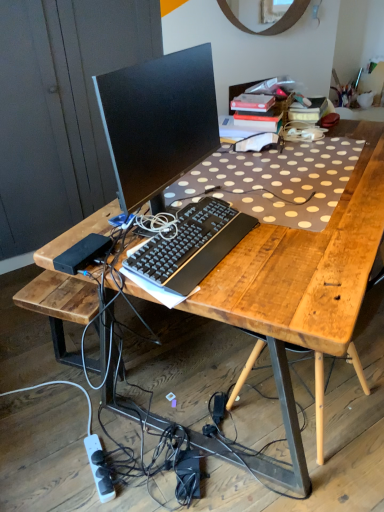
Where is `free space behind white plastic power strip at lower left`? The width and height of the screenshot is (384, 512). free space behind white plastic power strip at lower left is located at coordinates pyautogui.click(x=102, y=425).